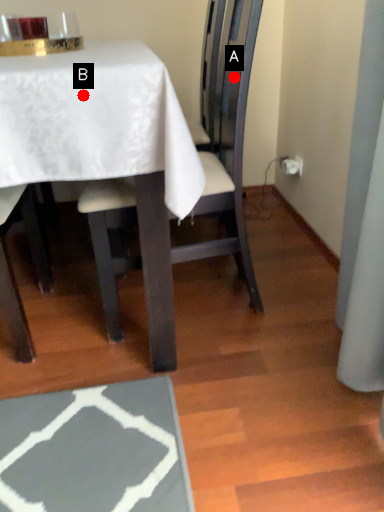
Question: Two points are circled on the image, labeled by A and B beside each circle. Which of the following is the farthest from the observer?

Choices:
 (A) A is further
 (B) B is further

Answer: (A)